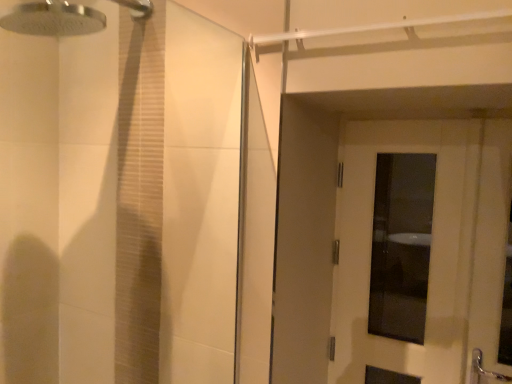
Image resolution: width=512 pixels, height=384 pixels. Describe the element at coordinates (430, 255) in the screenshot. I see `white matte door at center` at that location.

Where is `white matte door at center`? The height and width of the screenshot is (384, 512). white matte door at center is located at coordinates (430, 255).

What are the coordinates of `white matte door at center` in the screenshot? It's located at (430, 255).